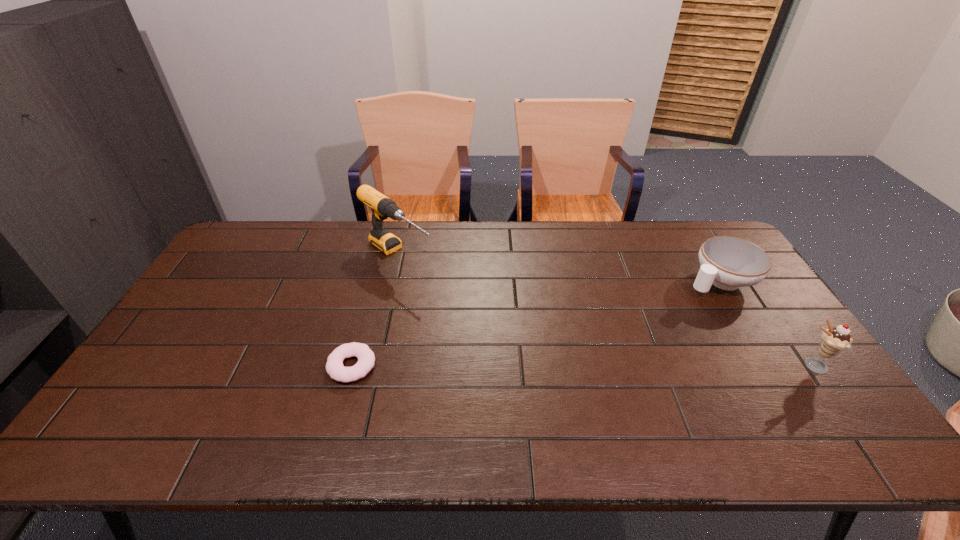
I want to click on empty location between the doughnut and the icecream, so click(x=582, y=366).

This screenshot has width=960, height=540. Find the location of `free spot between the second tallest object and the drill`. free spot between the second tallest object and the drill is located at coordinates (605, 310).

Image resolution: width=960 pixels, height=540 pixels. I want to click on empty space between the doughnut and the drill, so click(x=374, y=310).

This screenshot has height=540, width=960. Identify the location of free area in between the chinaware and the drill. (559, 267).

You are a GUI agent. You are given a task and a screenshot of the screen. Output one action in this format:
    pyautogui.click(x=<x>, y=<y>)
    Task: Click on the free space between the third shortest object and the tallest object
    The image size is (960, 540).
    Given the screenshot: What is the action you would take?
    pyautogui.click(x=605, y=310)

Locate an element on the screen. The height and width of the screenshot is (540, 960). object that can be found as the third closest to the shortest object is located at coordinates (834, 340).

I want to click on object that can be found as the third closest to the doughnut, so click(834, 340).

Find the location of a particular element. This screenshot has height=540, width=960. vacant region that satisfies the following two spatial constraints: 1. on the front side of the second shortest object; 2. on the left side of the second tallest object is located at coordinates (771, 366).

Identify the location of free point that satisfies the following two spatial constraints: 1. on the front side of the tallest object; 2. on the left side of the second tallest object. (372, 366).